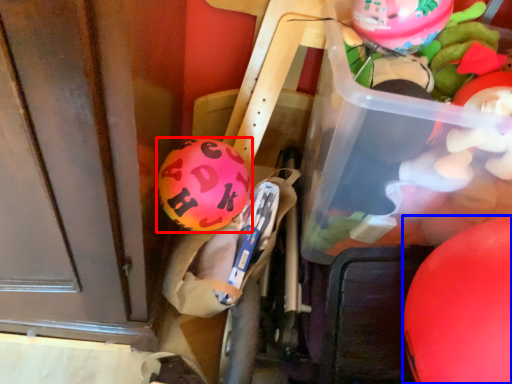
Question: Which of the following is the closest to the observer, balloon (highlighted by a red box) or balloon (highlighted by a blue box)?

Choices:
 (A) balloon
 (B) balloon

Answer: (B)